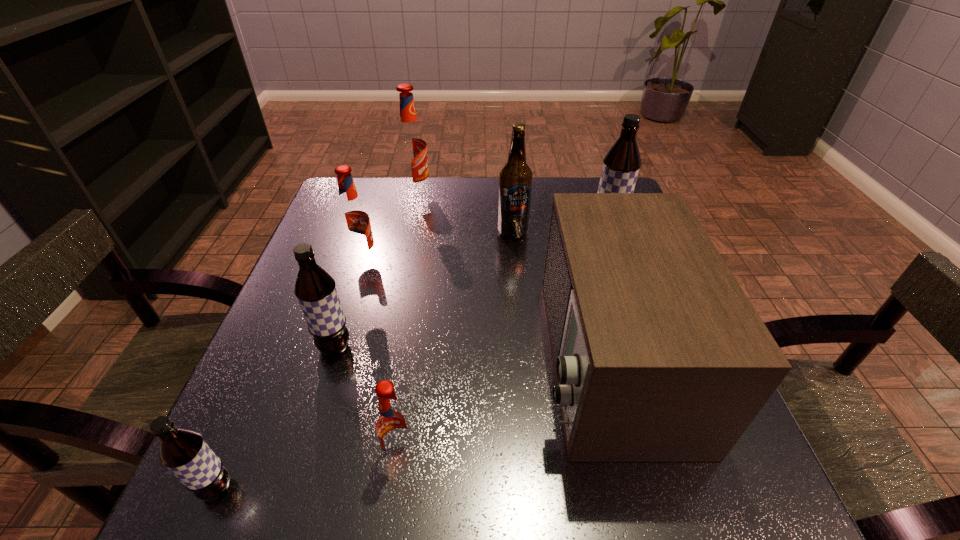
The width and height of the screenshot is (960, 540). I want to click on vacant space in between the fourth nearest root beer and the radio receiver, so 486,309.

Locate an element on the screen. Image resolution: width=960 pixels, height=540 pixels. vacant area between the second brown root beer from left to right and the leftmost brown root beer is located at coordinates (276, 418).

The height and width of the screenshot is (540, 960). I want to click on vacant space that's between the smallest red root beer and the nearest root beer, so click(x=308, y=471).

Where is `object that stands as the closest to the second brown root beer from right to left`? object that stands as the closest to the second brown root beer from right to left is located at coordinates (393, 425).

Identify the location of object that ranks as the third closest to the nearest root beer. The width and height of the screenshot is (960, 540). (353, 218).

Identify the location of the fifth closest root beer to the nearest brown root beer. The image size is (960, 540). (621, 165).

The height and width of the screenshot is (540, 960). What are the coordinates of `root beer object that ranks as the fourth closest to the beer bottle` in the screenshot? It's located at click(x=315, y=289).

Identify which red root beer is the third closest to the second brown root beer from right to left. Please provide its 2D coordinates. Your answer should be formatted as a tuple, i.e. [(x, y)], where the tuple contains the x and y coordinates of a point satisfying the conditions above.

[(411, 148)]

You are a GUI agent. You are given a task and a screenshot of the screen. Output one action in this format:
    pyautogui.click(x=<x>, y=<y>)
    Task: Click on the red root beer that is the third closest to the radio receiver
    The image size is (960, 540).
    Given the screenshot: What is the action you would take?
    pyautogui.click(x=411, y=148)

Select which brown root beer is the second closest to the leftmost brown root beer. Please provide its 2D coordinates. Your answer should be formatted as a tuple, i.e. [(x, y)], where the tuple contains the x and y coordinates of a point satisfying the conditions above.

[(621, 165)]